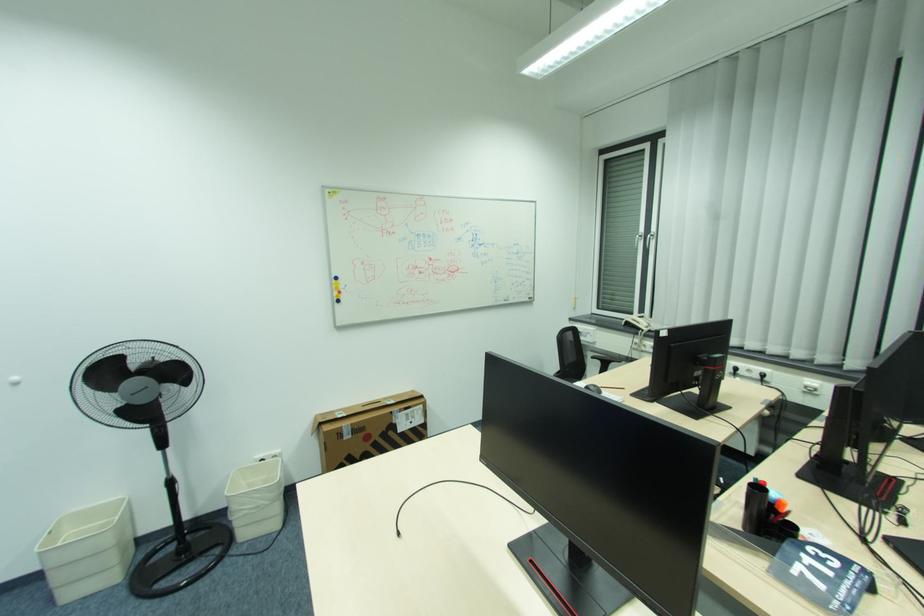
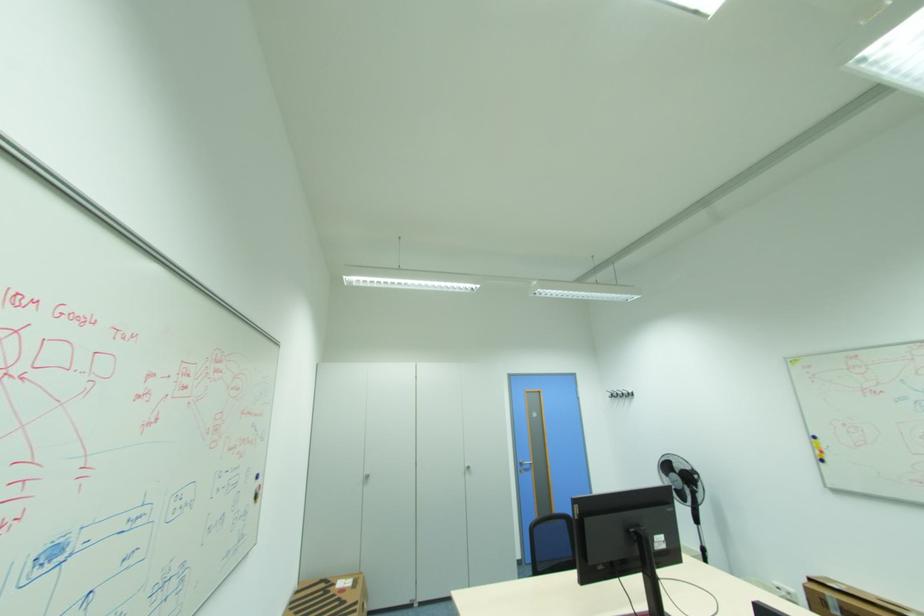
Locate, in the second image, the point that corresponds to (x=341, y=294) in the first image.

(822, 453)